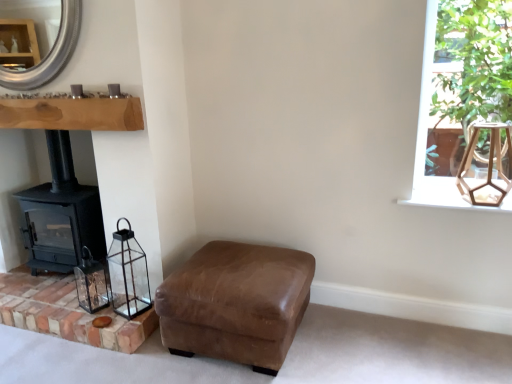
Question: Looking at their shapes, would you say brickroughbrickwork at lower left is wider or thinner than clear glass lantern at lower left?

Choices:
 (A) thin
 (B) wide

Answer: (B)

Question: From the image's perspective, is brickroughbrickwork at lower left positioned above or below clear glass lantern at lower left?

Choices:
 (A) below
 (B) above

Answer: (A)

Question: Estimate the real-world distances between objects in this image. Which object is farther from the green leafy plant at upper right?

Choices:
 (A) clear glass lantern at lower left, the 2th lamp from the top
 (B) brown leather ottoman at lower center
 (C) silver metallic mirror at upper left
 (D) black matte wood burning stove at left
 (E) wooden hexagonal lantern at upper right, arranged as the 2th lamp when viewed from the left

Answer: (D)

Question: Estimate the real-world distances between objects in this image. Which object is farther from the wooden hexagonal lantern at upper right, the 2th lamp in the bottom-to-top sequence?

Choices:
 (A) silver metallic mirror at upper left
 (B) clear glass lantern at lower left
 (C) brickroughbrickwork at lower left
 (D) black matte wood burning stove at left
 (E) green leafy plant at upper right

Answer: (D)